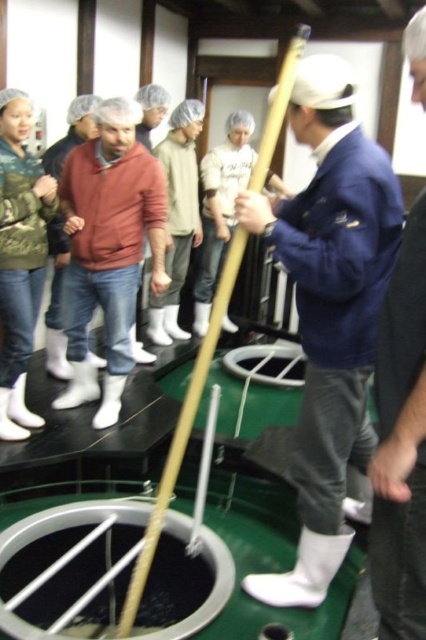
Question: Which of the following is the farthest from the observer?

Choices:
 (A) white plastic hole at center
 (B) green textured jacket at upper left
 (C) smooth black hole at center
 (D) white matte jacket at center

Answer: (A)

Question: Among these points, which one is nearest to the camera?

Choices:
 (A) (330, 300)
 (B) (388, 412)
 (C) (8, 164)

Answer: (B)

Question: Does smooth black hole at center appear on the left side of white plastic hole at center?

Choices:
 (A) yes
 (B) no

Answer: (A)

Question: Can you confirm if green textured jacket at upper left is positioned below white plastic hole at center?

Choices:
 (A) no
 (B) yes

Answer: (A)

Question: Can you confirm if smooth black hole at center is positioned below white plastic hole at center?

Choices:
 (A) yes
 (B) no

Answer: (A)

Question: Among these points, which one is farthest from the camera?

Choices:
 (A) (16, 172)
 (B) (275, 374)
 (C) (420, 384)
 (D) (308, 120)

Answer: (B)